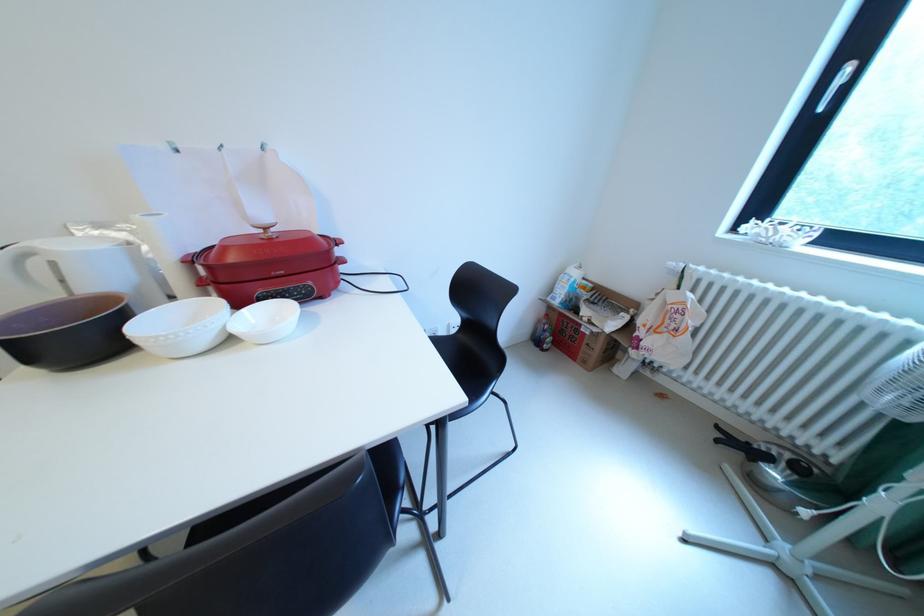
The height and width of the screenshot is (616, 924). I want to click on black chair sitting surface, so click(x=450, y=355).